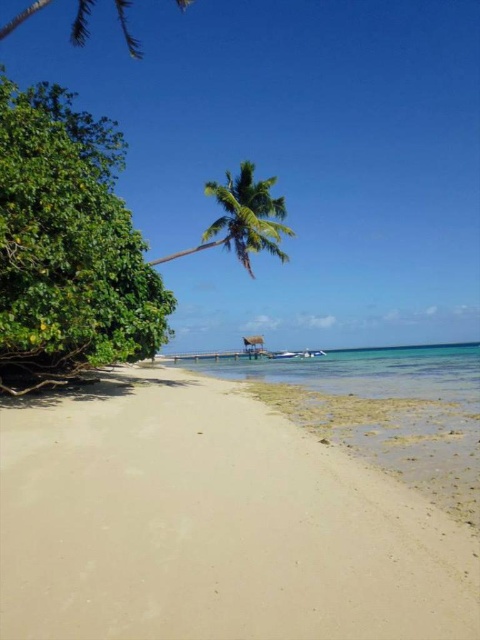
Does beige sandy beach at lower left have a smaller size compared to green leafy palm tree at center?

Correct, beige sandy beach at lower left occupies less space than green leafy palm tree at center.

Does beige sandy beach at lower left appear on the left side of green leafy palm tree at center?

Indeed, beige sandy beach at lower left is positioned on the left side of green leafy palm tree at center.

Is point (142, 451) closer to camera compared to point (204, 237)?

Yes.

You are a GUI agent. You are given a task and a screenshot of the screen. Output one action in this format:
    pyautogui.click(x=<x>, y=<y>)
    Task: Click on the beige sandy beach at lower left
    
    Given the screenshot: What is the action you would take?
    pyautogui.click(x=213, y=524)

Identify the location of green leafy palm tree at center. (248, 216).

Describe the element at coordinates (248, 216) in the screenshot. I see `green leafy palm tree at center` at that location.

The image size is (480, 640). I want to click on green leafy palm tree at center, so pyautogui.click(x=248, y=216).

Which is below, beige sandy beach at lower left or clear blue water at center?

Positioned lower is clear blue water at center.

Is beige sandy beach at lower left thinner than clear blue water at center?

Correct, beige sandy beach at lower left's width is less than clear blue water at center's.

In the scene shown: Measure the distance between point (287,422) and camera.

They are 10.88 meters apart.

Identify the location of beige sandy beach at lower left. (213, 524).